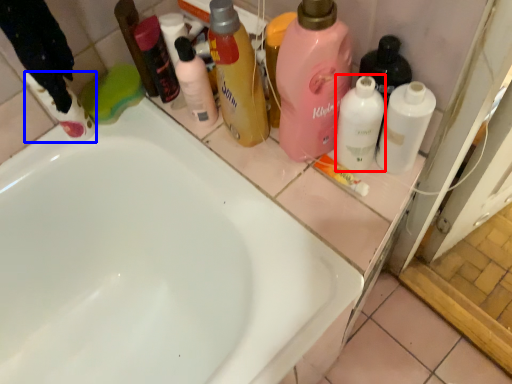
Question: Which object is closer to the camera taking this photo, cleaning product (highlighted by a red box) or cleaning product (highlighted by a blue box)?

Choices:
 (A) cleaning product
 (B) cleaning product

Answer: (A)